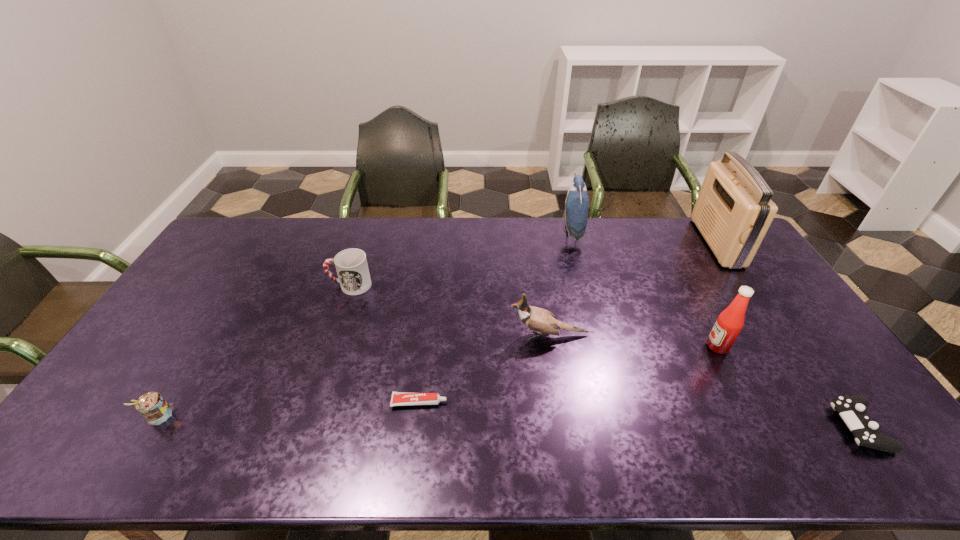
This screenshot has width=960, height=540. In the image, there is a desktop. What are the coordinates of `free region at the far edge` in the screenshot? It's located at (579, 246).

This screenshot has width=960, height=540. I want to click on vacant area at the near edge of the desktop, so click(x=720, y=446).

You are a GUI agent. You are given a task and a screenshot of the screen. Output one action in this format:
    pyautogui.click(x=<x>, y=<y>)
    Task: Click on the vacant space at the left edge of the desktop
    
    Given the screenshot: What is the action you would take?
    pyautogui.click(x=152, y=336)

Identify the location of vacant area at the right edge. The height and width of the screenshot is (540, 960). pyautogui.click(x=837, y=417).

You are a GUI agent. You are given a task and a screenshot of the screen. Output one action in this format:
    pyautogui.click(x=<x>, y=<y>)
    Task: Click on the free space at the far left corner
    
    Given the screenshot: What is the action you would take?
    pyautogui.click(x=214, y=247)

Locate an element on the screen. The width and height of the screenshot is (960, 540). vacant area at the near left corner of the desktop is located at coordinates (96, 460).

Where is `blank region between the third object from right to left and the shorter bird`? The height and width of the screenshot is (540, 960). blank region between the third object from right to left and the shorter bird is located at coordinates (634, 340).

Image resolution: width=960 pixels, height=540 pixels. I want to click on unoccupied area between the third object from left to right and the taller bird, so click(495, 317).

Identify the location of unoccupied area between the shorter bird and the farther bird. (561, 284).

I want to click on free space between the toothpaste and the control, so click(x=639, y=414).